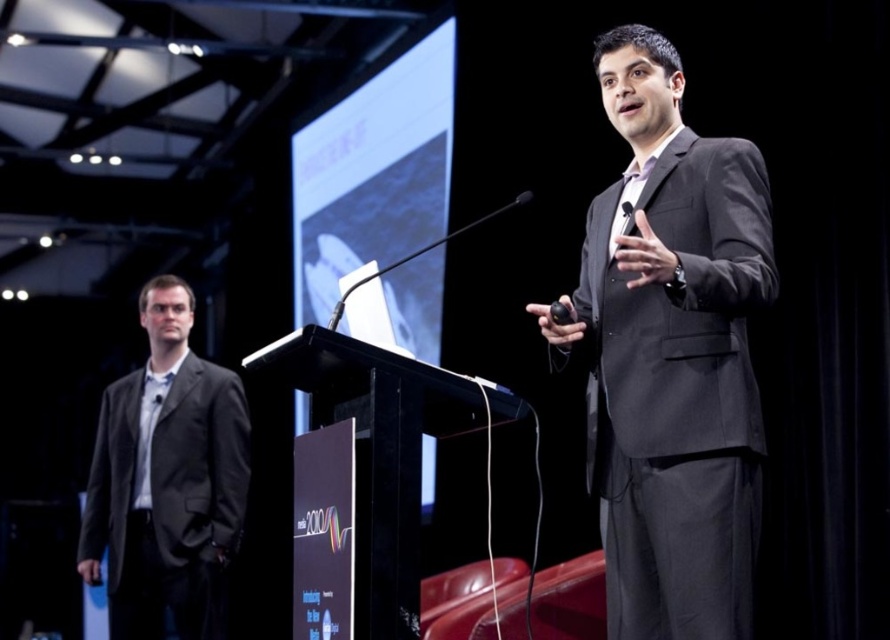
You are a photographer at the presentation. You need to place a small light at the point marked as point (670, 355). According to the scene description, where exactly should you place the light?

The point (670, 355) is on the matte black suit at center, so you should place the light on the matte black suit at center.

You are standing in the presentation room and want to approach the black matte podium at center. Which direction should you move relative to your current position?

The black matte podium at center is located at point coordinates of 0.705 on the x axis and 0.431 on the y axis. Since you are in the presentation room, you should move towards the center area where the podium is placed.